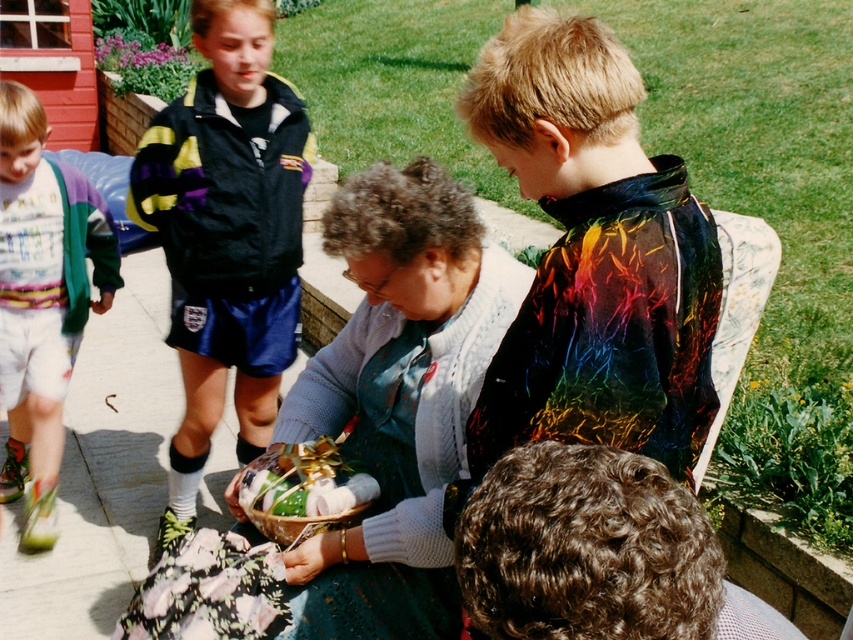
You are organizing a clothing donation drive and need to determine which item takes up more space. Based on the image, which of the two items, the knitted sweater at center or the black jacket at upper left, has a greater width?

The knitted sweater at center has a greater width than the black jacket at upper left according to the description.

You are organizing a clothing donation drive and need to sort items by size. You have a knitted sweater at center and a black jacket at upper left. Which item should you place in the small items bin?

The knitted sweater at center should be placed in the small items bin since it is smaller than the black jacket at upper left.